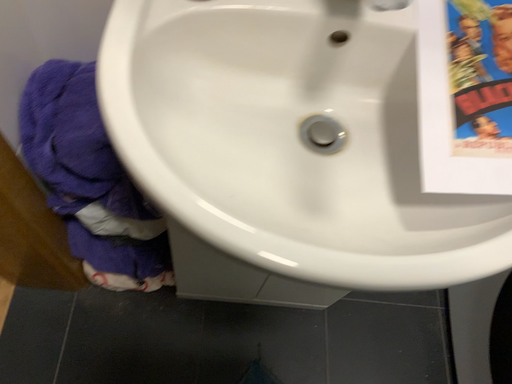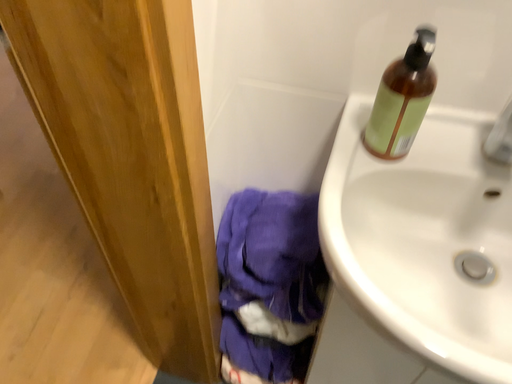
Question: Which way did the camera rotate in the video?

Choices:
 (A) rotated downward
 (B) rotated upward

Answer: (B)